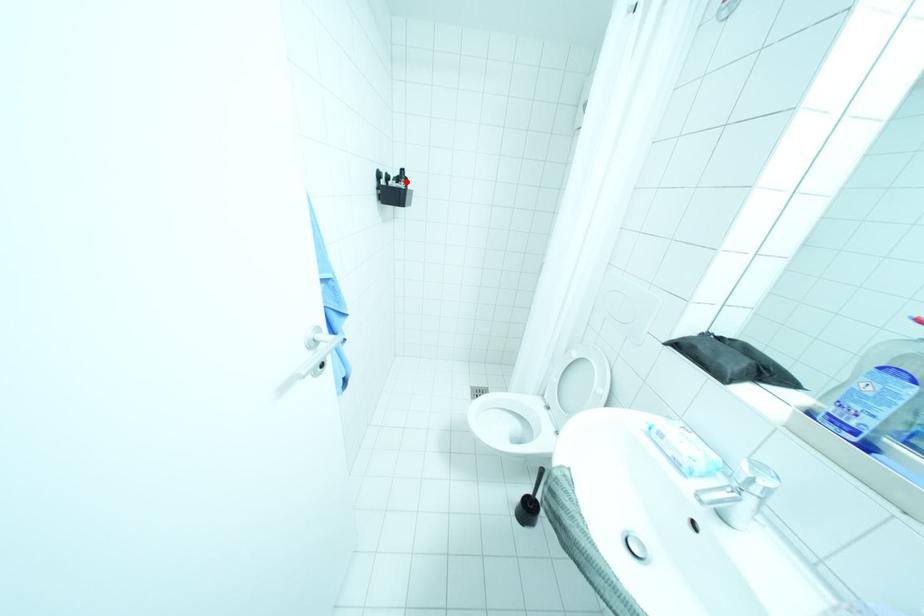
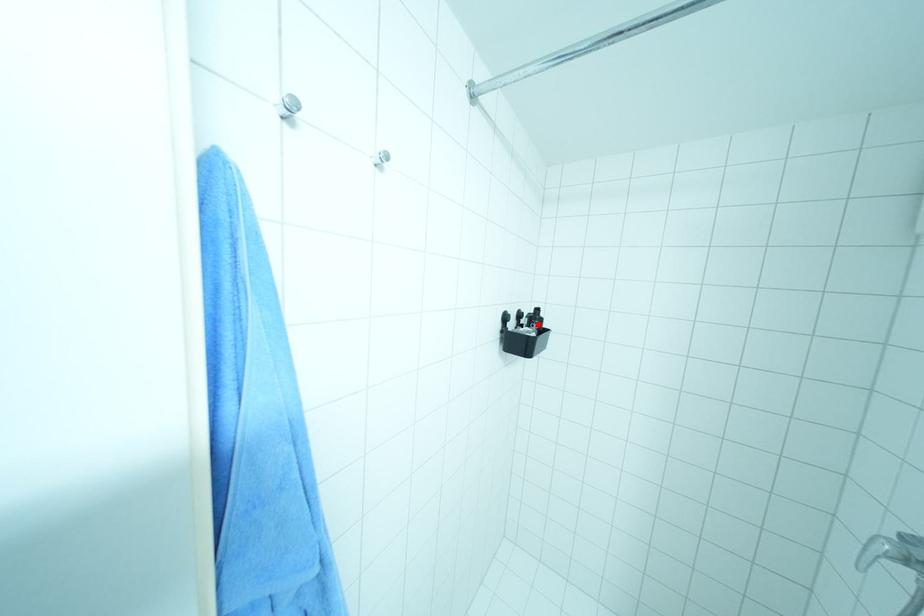
I am providing you with two images of the same scene from different viewpoints. A red point is marked on the first image and another point is marked on the second image. Do the highlighted points in image1 and image2 indicate the same real-world spot?

Yes